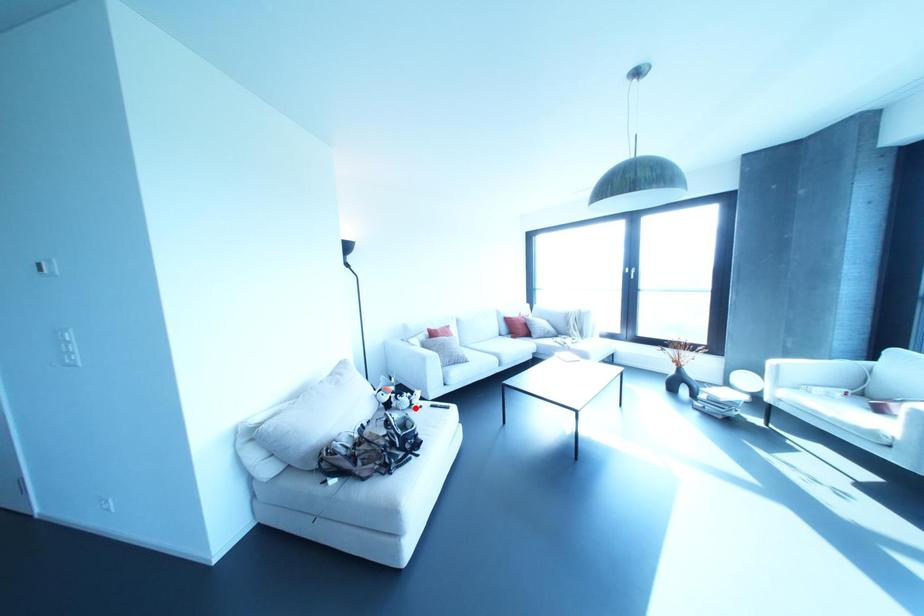
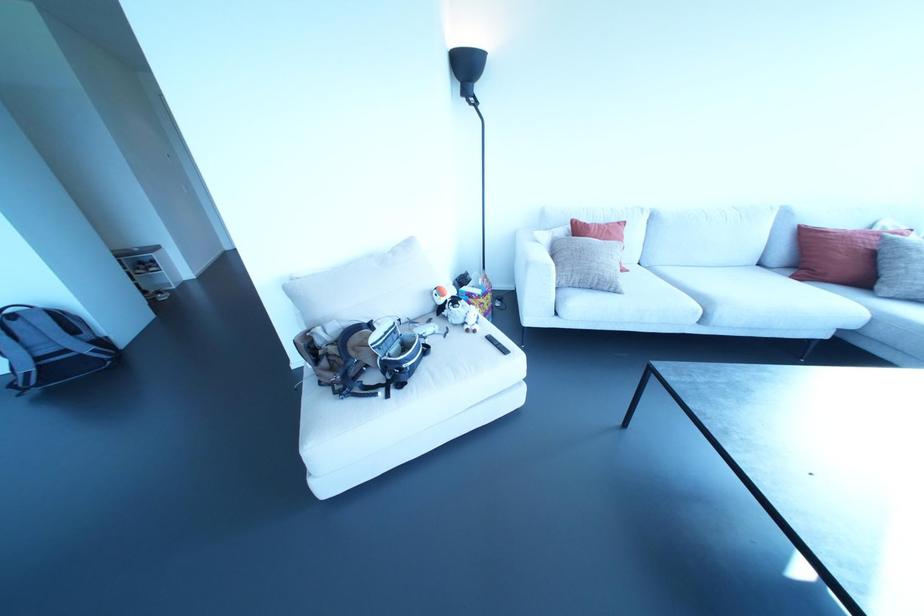
Question: I am providing you with two images of the same scene from different viewpoints. A red point is marked on the first image. Is the red point's position out of view in image 2?

Choices:
 (A) Yes
 (B) No

Answer: (B)